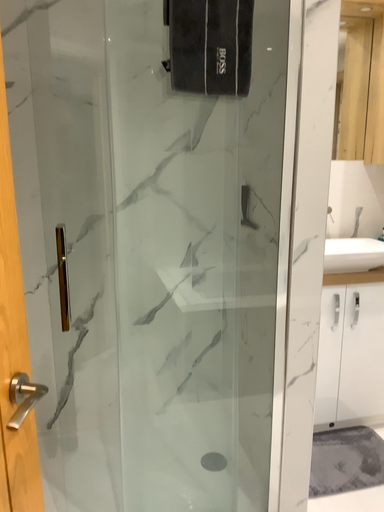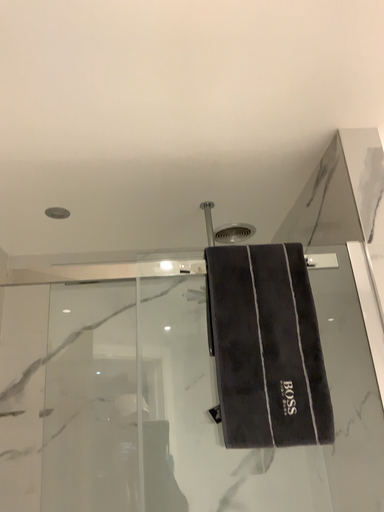
Question: How did the camera likely rotate when shooting the video?

Choices:
 (A) rotated downward
 (B) rotated upward

Answer: (B)